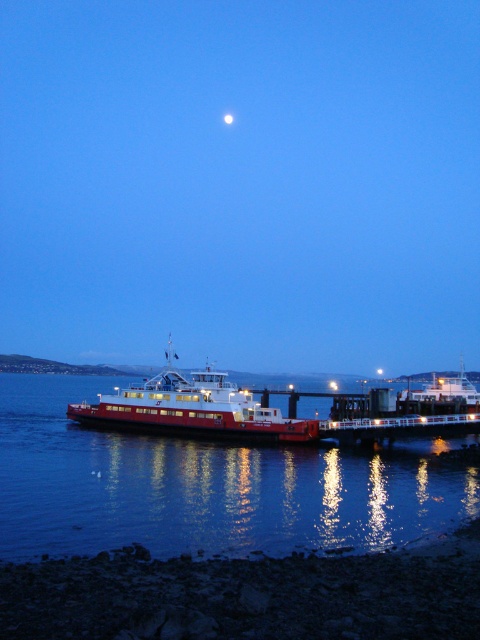
Which is more to the left, glossy water at lower left or smooth sand shoreline at lower left?

glossy water at lower left

Which of these two, glossy water at lower left or smooth sand shoreline at lower left, stands shorter?

smooth sand shoreline at lower left

Locate an element on the screen. This screenshot has width=480, height=640. glossy water at lower left is located at coordinates (204, 484).

The width and height of the screenshot is (480, 640). I want to click on glossy water at lower left, so click(x=204, y=484).

Is glossy water at lower left positioned in front of red matte ferry at center?

Yes, it is.

How much distance is there between glossy water at lower left and red matte ferry at center?

glossy water at lower left and red matte ferry at center are 8.00 meters apart from each other.

Between point (192, 481) and point (168, 397), which one is positioned in front?

Point (192, 481) is in front.

The image size is (480, 640). I want to click on glossy water at lower left, so click(204, 484).

The image size is (480, 640). Identify the location of smooth sand shoreline at lower left. (249, 595).

Who is positioned more to the right, smooth sand shoreline at lower left or red matte ferry at center?

From the viewer's perspective, smooth sand shoreline at lower left appears more on the right side.

Locate an element on the screen. This screenshot has height=640, width=480. smooth sand shoreline at lower left is located at coordinates (249, 595).